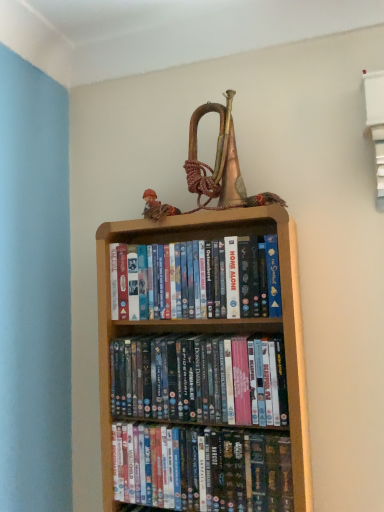
In order to face wooden bookcase at center, should I rotate leftwards or rightwards?

It's best to rotate right around 1.078 degrees.

In order to click on matte plastic dvds at center, the first book viewed from the top in this screenshot , I will do `click(188, 280)`.

Where is `matte brown doll at upper center`? The height and width of the screenshot is (512, 384). matte brown doll at upper center is located at coordinates (156, 207).

The image size is (384, 512). I want to click on matte plastic dvds at center, positioned as the 2th book in bottom-to-top order, so click(x=200, y=380).

Considering the sizes of objects shiny plastic dvds at center, which is the third book from top to bottom, and matte plastic dvds at center, the first book viewed from the top, in the image provided, who is bigger, shiny plastic dvds at center, which is the third book from top to bottom, or matte plastic dvds at center, the first book viewed from the top,?

Bigger between the two is matte plastic dvds at center, the first book viewed from the top.

From the image's perspective, is shiny plastic dvds at center, which is the third book from top to bottom, below matte plastic dvds at center, the first book viewed from the top?

Yes, from the image's perspective, shiny plastic dvds at center, which is the third book from top to bottom, is beneath matte plastic dvds at center, the first book viewed from the top.

Which is closer to the camera, (172, 432) or (156, 290)?

Clearly, point (172, 432) is closer to the camera than point (156, 290).

Could you tell me if shiny plastic dvds at center, which is the third book from top to bottom, is turned towards matte plastic dvds at center, acting as the 3th book starting from the bottom?

No.

Is matte plastic dvds at center, positioned as the 2th book in bottom-to-top order, positioned in front of matte plastic dvds at center, acting as the 3th book starting from the bottom?

Yes, it is.

Locate an element on the screen. Image resolution: width=384 pixels, height=512 pixels. book behind the matte plastic dvds at center, positioned as the 2th book in bottom-to-top order is located at coordinates (188, 280).

Between matte plastic dvds at center, marked as the 2th book in a top-to-bottom arrangement, and matte plastic dvds at center, the first book viewed from the top, which one has larger width?

Wider between the two is matte plastic dvds at center, the first book viewed from the top.

Is matte plastic dvds at center, positioned as the 2th book in bottom-to-top order, located within matte brown doll at upper center?

No.

Can you tell me how much matte brown doll at upper center and matte plastic dvds at center, marked as the 2th book in a top-to-bottom arrangement, differ in facing direction?

The angular difference between matte brown doll at upper center and matte plastic dvds at center, marked as the 2th book in a top-to-bottom arrangement, is 3.23 degrees.

In terms of height, does matte brown doll at upper center look taller or shorter compared to matte plastic dvds at center, marked as the 2th book in a top-to-bottom arrangement?

Considering their sizes, matte brown doll at upper center has less height than matte plastic dvds at center, marked as the 2th book in a top-to-bottom arrangement.

Which is nearer, (215, 308) or (235, 405)?

Point (215, 308) is positioned farther from the camera compared to point (235, 405).

The height and width of the screenshot is (512, 384). I want to click on the 1st book below the matte plastic dvds at center, acting as the 3th book starting from the bottom (from a real-world perspective), so click(x=200, y=380).

Does matte plastic dvds at center, positioned as the 2th book in bottom-to-top order, have a greater width compared to wooden bookcase at center?

Indeed, matte plastic dvds at center, positioned as the 2th book in bottom-to-top order, has a greater width compared to wooden bookcase at center.

Would you say matte plastic dvds at center, marked as the 2th book in a top-to-bottom arrangement, is to the left or to the right of wooden bookcase at center in the picture?

Based on their positions, matte plastic dvds at center, marked as the 2th book in a top-to-bottom arrangement, is located to the right of wooden bookcase at center.

From the image's perspective, who appears lower, matte plastic dvds at center, positioned as the 2th book in bottom-to-top order, or wooden bookcase at center?

wooden bookcase at center.

Considering the points (284, 380) and (303, 442), which point is in front, point (284, 380) or point (303, 442)?

Point (284, 380)

From the image's perspective, between matte brown doll at upper center and matte plastic dvds at center, the first book viewed from the top, which one is located above?

From the image's view, matte brown doll at upper center is above.

From a real-world perspective, is matte brown doll at upper center positioned over matte plastic dvds at center, the first book viewed from the top, based on gravity?

Indeed, from a real-world perspective, matte brown doll at upper center stands above matte plastic dvds at center, the first book viewed from the top.

From the picture: Which is more to the left, matte brown doll at upper center or matte plastic dvds at center, the first book viewed from the top?

From the viewer's perspective, matte brown doll at upper center appears more on the left side.

Is matte brown doll at upper center facing away from matte plastic dvds at center, acting as the 3th book starting from the bottom?

matte brown doll at upper center is not turned away from matte plastic dvds at center, acting as the 3th book starting from the bottom.

Is point (274, 510) positioned before point (161, 209)?

Yes, it is in front of point (161, 209).

Can you confirm if shiny plastic dvds at center, arranged as the first book when ordered from the bottom, is positioned to the left of matte brown doll at upper center?

Incorrect, shiny plastic dvds at center, arranged as the first book when ordered from the bottom, is not on the left side of matte brown doll at upper center.

From the image's perspective, which is above, shiny plastic dvds at center, which is the third book from top to bottom, or matte brown doll at upper center?

matte brown doll at upper center appears higher in the image.

At what (x,y) coordinates should I click in order to perform the action: click on the 2nd book counting from the right side of the matte plastic dvds at center, acting as the 3th book starting from the bottom. Please return your answer as a coordinate pair (x, y). This screenshot has height=512, width=384. Looking at the image, I should click on (201, 469).

Locate an element on the screen. book that is above the matte plastic dvds at center, marked as the 2th book in a top-to-bottom arrangement (from a real-world perspective) is located at coordinates (188, 280).

From the image, which object appears to be farther from wooden bookcase at center, matte plastic dvds at center, acting as the 3th book starting from the bottom, or matte brown doll at upper center?

The object further to wooden bookcase at center is matte brown doll at upper center.

Estimate the real-world distances between objects in this image. Which object is closer to wooden bookcase at center, shiny plastic dvds at center, which is the third book from top to bottom, or matte plastic dvds at center, marked as the 2th book in a top-to-bottom arrangement?

The object closer to wooden bookcase at center is matte plastic dvds at center, marked as the 2th book in a top-to-bottom arrangement.

From the image, which object appears to be farther from matte plastic dvds at center, marked as the 2th book in a top-to-bottom arrangement, wooden bookcase at center or shiny plastic dvds at center, which is the third book from top to bottom?

wooden bookcase at center lies further to matte plastic dvds at center, marked as the 2th book in a top-to-bottom arrangement, than the other object.

Estimate the real-world distances between objects in this image. Which object is closer to shiny plastic dvds at center, arranged as the first book when ordered from the bottom, matte plastic dvds at center, positioned as the 2th book in bottom-to-top order, or matte plastic dvds at center, the first book viewed from the top?

Based on the image, matte plastic dvds at center, positioned as the 2th book in bottom-to-top order, appears to be nearer to shiny plastic dvds at center, arranged as the first book when ordered from the bottom.

Looking at the image, which one is located further to shiny plastic dvds at center, which is the third book from top to bottom, matte plastic dvds at center, acting as the 3th book starting from the bottom, or matte brown doll at upper center?

Based on the image, matte brown doll at upper center appears to be further to shiny plastic dvds at center, which is the third book from top to bottom.

Based on their spatial positions, is matte plastic dvds at center, acting as the 3th book starting from the bottom, or wooden bookcase at center closer to matte brown doll at upper center?

matte plastic dvds at center, acting as the 3th book starting from the bottom, is closer to matte brown doll at upper center.

Estimate the real-world distances between objects in this image. Which object is closer to shiny plastic dvds at center, which is the third book from top to bottom, wooden bookcase at center or matte brown doll at upper center?

The object closer to shiny plastic dvds at center, which is the third book from top to bottom, is wooden bookcase at center.

Looking at the image, which one is located closer to matte plastic dvds at center, positioned as the 2th book in bottom-to-top order, matte plastic dvds at center, acting as the 3th book starting from the bottom, or wooden bookcase at center?

The object closer to matte plastic dvds at center, positioned as the 2th book in bottom-to-top order, is wooden bookcase at center.

Where is `bookcase between matte plastic dvds at center, the first book viewed from the top, and shiny plastic dvds at center, which is the third book from top to bottom, in the vertical direction`? The image size is (384, 512). bookcase between matte plastic dvds at center, the first book viewed from the top, and shiny plastic dvds at center, which is the third book from top to bottom, in the vertical direction is located at coordinates (213, 319).

At what (x,y) coordinates should I click in order to perform the action: click on bookcase between matte plastic dvds at center, positioned as the 2th book in bottom-to-top order, and shiny plastic dvds at center, arranged as the first book when ordered from the bottom, vertically. Please return your answer as a coordinate pair (x, y). Looking at the image, I should click on (213, 319).

Find the location of a particular element. The width and height of the screenshot is (384, 512). book between matte brown doll at upper center and matte plastic dvds at center, positioned as the 2th book in bottom-to-top order, from top to bottom is located at coordinates (188, 280).

At what (x,y) coordinates should I click in order to perform the action: click on book that lies between matte plastic dvds at center, acting as the 3th book starting from the bottom, and shiny plastic dvds at center, arranged as the first book when ordered from the bottom, from top to bottom. Please return your answer as a coordinate pair (x, y). Looking at the image, I should click on (200, 380).